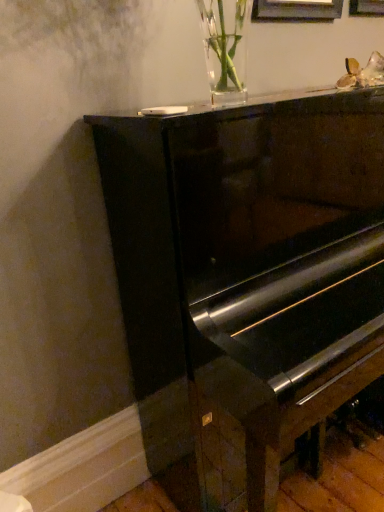
Locate an element on the screen. The width and height of the screenshot is (384, 512). glossy dark wood piano at center is located at coordinates (247, 278).

The height and width of the screenshot is (512, 384). Describe the element at coordinates (247, 278) in the screenshot. I see `glossy dark wood piano at center` at that location.

This screenshot has width=384, height=512. Identify the location of glossy dark wood piano at center. (247, 278).